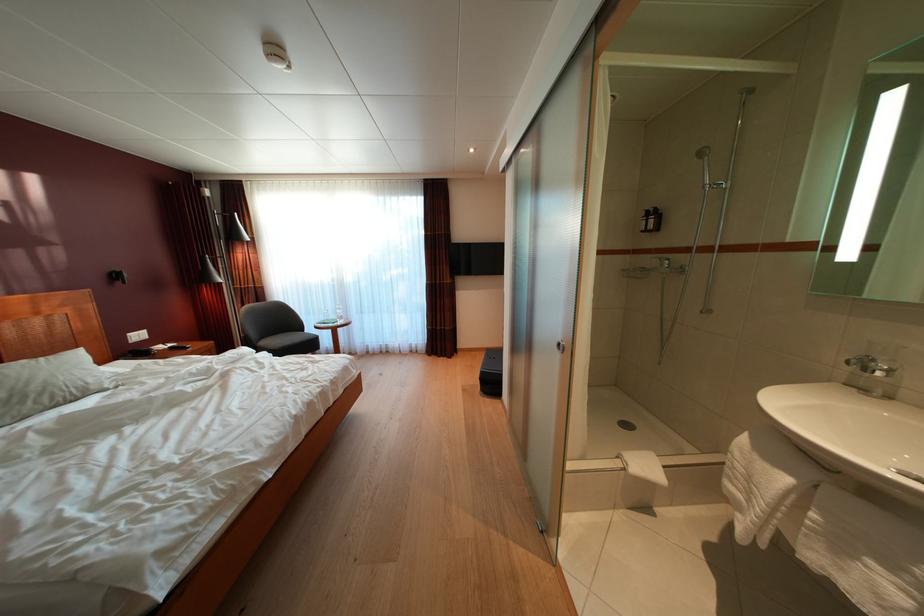
Locate an element on the screen. This screenshot has width=924, height=616. shower mixer handle is located at coordinates (684, 270).